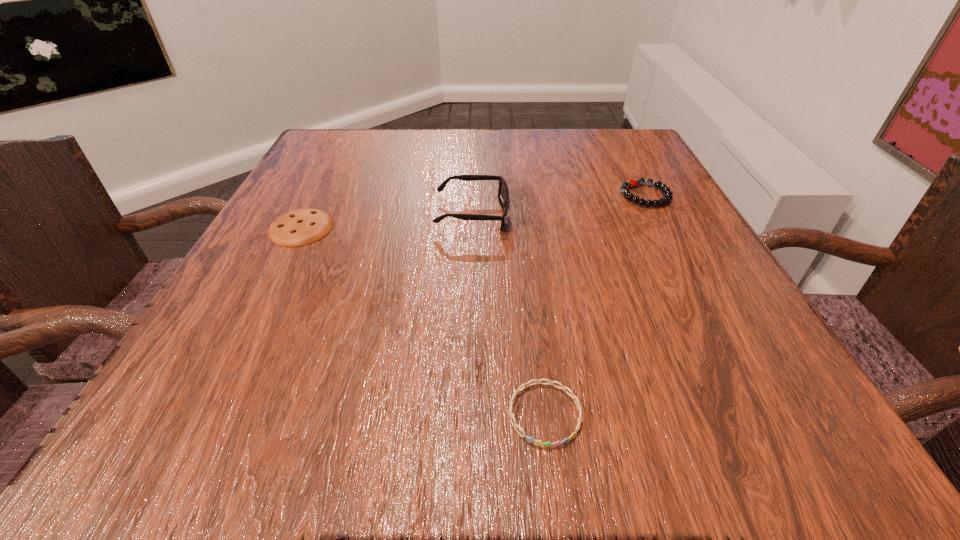
In order to click on object positioned at the left edge in this screenshot , I will do `click(299, 227)`.

Image resolution: width=960 pixels, height=540 pixels. Identify the location of object that is at the right edge. (667, 198).

You are a GUI agent. You are given a task and a screenshot of the screen. Output one action in this format:
    pyautogui.click(x=<x>, y=<y>)
    Task: Click on the free space at the far edge of the desktop
    This screenshot has width=960, height=540.
    Given the screenshot: What is the action you would take?
    pyautogui.click(x=569, y=139)

In order to click on vacant region at the near edge of the desktop in this screenshot , I will do `click(444, 428)`.

The image size is (960, 540). Identify the location of vacant area at the left edge of the desktop. (278, 200).

The width and height of the screenshot is (960, 540). I want to click on vacant space at the right edge, so click(x=708, y=377).

Locate an element on the screen. This screenshot has height=540, width=960. free space at the far left corner is located at coordinates (313, 161).

Locate an element on the screen. Image resolution: width=960 pixels, height=540 pixels. vacant space at the near left corner of the desktop is located at coordinates (156, 406).

The image size is (960, 540). Identify the location of free space between the cookie and the taller bracelet. (473, 212).

This screenshot has height=540, width=960. I want to click on free space between the sunglasses and the cookie, so click(x=387, y=221).